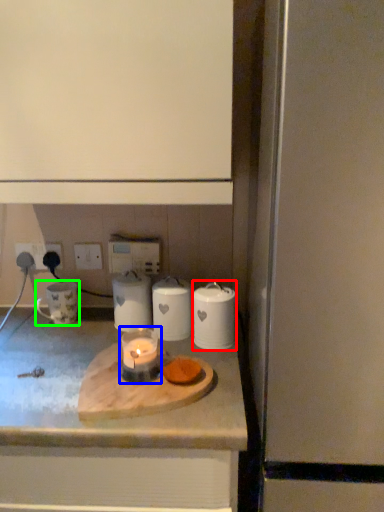
Question: Estimate the real-world distances between objects in this image. Which object is farther from appliance (highlighted by a red box), candle holder (highlighted by a blue box) or appliance (highlighted by a green box)?

Choices:
 (A) candle holder
 (B) appliance

Answer: (B)